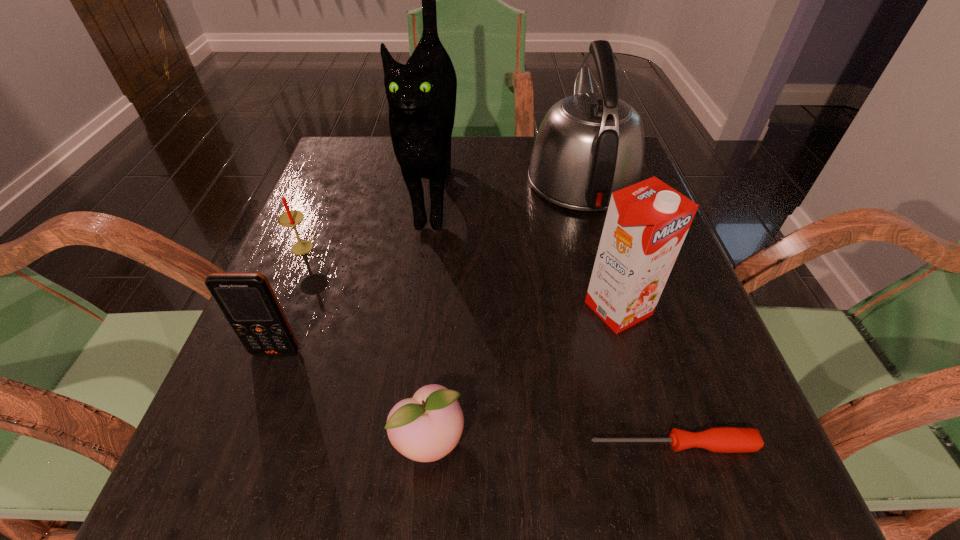
Identify the location of vacant space at the left edge. (344, 284).

You are a GUI agent. You are given a task and a screenshot of the screen. Output one action in this format:
    pyautogui.click(x=<x>, y=<y>)
    Task: Click on the vacant space at the right edge of the desktop
    The height and width of the screenshot is (540, 960).
    Given the screenshot: What is the action you would take?
    pyautogui.click(x=638, y=422)

Locate an element on the screen. free spot at the near left corner of the desktop is located at coordinates (228, 469).

I want to click on free space at the near right corner, so click(x=707, y=496).

Locate an element on the screen. This screenshot has height=540, width=960. vacant region between the candle and the fourth shortest object is located at coordinates (291, 300).

At what (x,y) coordinates should I click in order to perform the action: click on vacant point located between the carton and the peach. Please return your answer as a coordinate pair (x, y). Looking at the image, I should click on (523, 375).

At what (x,y) coordinates should I click in order to perform the action: click on free space between the cellular telephone and the screwdriver. Please return your answer as a coordinate pair (x, y). Looking at the image, I should click on (474, 398).

Find the location of `free spot between the screwdriver and the fourth shortest object`. free spot between the screwdriver and the fourth shortest object is located at coordinates (474, 398).

Where is `vacant area that lies between the shortest object and the cat`? The height and width of the screenshot is (540, 960). vacant area that lies between the shortest object and the cat is located at coordinates (553, 315).

You are a GUI agent. You are given a task and a screenshot of the screen. Output one action in this format:
    pyautogui.click(x=<x>, y=<y>)
    Task: Click on the blank region between the peach and the tallest object
    The width and height of the screenshot is (960, 540).
    Given the screenshot: What is the action you would take?
    pyautogui.click(x=432, y=314)